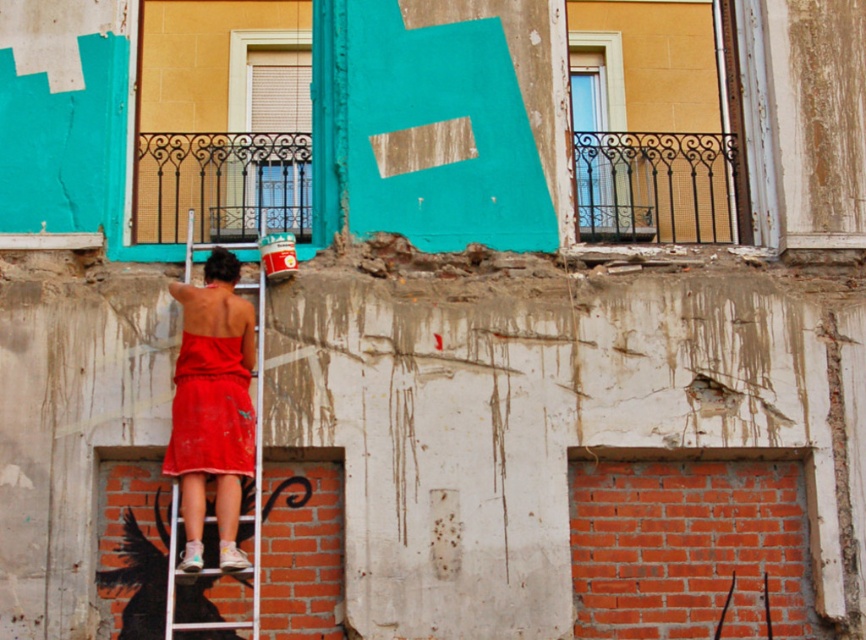
Is point (373, 168) farther from viewer compared to point (171, 608)?

Yes, point (373, 168) is farther from viewer.

Consider the image. Does teal matte letter at center have a greater height compared to white metallic ladder at center?

Incorrect, teal matte letter at center's height is not larger of white metallic ladder at center's.

Locate an element on the screen. Image resolution: width=866 pixels, height=640 pixels. teal matte letter at center is located at coordinates (438, 134).

Locate an element on the screen. Image resolution: width=866 pixels, height=640 pixels. teal matte letter at center is located at coordinates (438, 134).